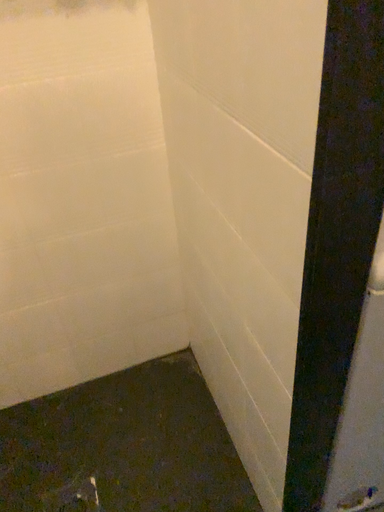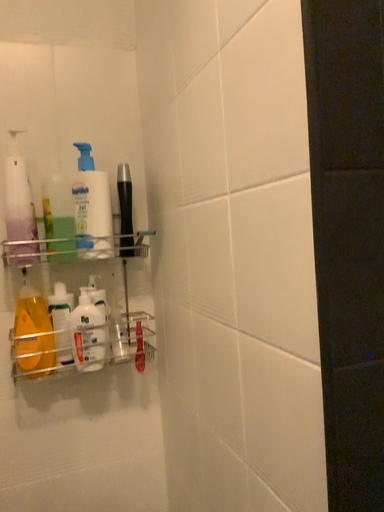
Question: How did the camera likely rotate when shooting the video?

Choices:
 (A) rotated upward
 (B) rotated downward

Answer: (A)